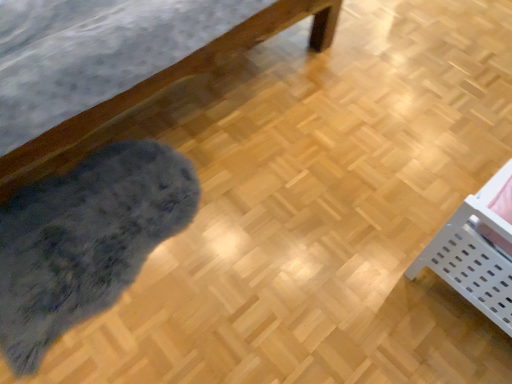
Question: From a real-world perspective, relative to fuzzy gray mat at lower left, is white plastic basket at lower right vertically above or below?

Choices:
 (A) above
 (B) below

Answer: (A)

Question: Looking at their shapes, would you say white plastic basket at lower right is wider or thinner than fuzzy gray mat at lower left?

Choices:
 (A) wide
 (B) thin

Answer: (B)

Question: In terms of height, does white plastic basket at lower right look taller or shorter compared to fuzzy gray mat at lower left?

Choices:
 (A) short
 (B) tall

Answer: (B)

Question: Looking at their shapes, would you say fuzzy gray mat at lower left is wider or thinner than white plastic basket at lower right?

Choices:
 (A) wide
 (B) thin

Answer: (A)

Question: Is fuzzy gray mat at lower left in front of or behind white plastic basket at lower right in the image?

Choices:
 (A) front
 (B) behind

Answer: (B)

Question: Is fuzzy gray mat at lower left inside or outside of white plastic basket at lower right?

Choices:
 (A) outside
 (B) inside

Answer: (A)

Question: Considering the positions of fuzzy gray mat at lower left and white plastic basket at lower right in the image, is fuzzy gray mat at lower left taller or shorter than white plastic basket at lower right?

Choices:
 (A) tall
 (B) short

Answer: (B)